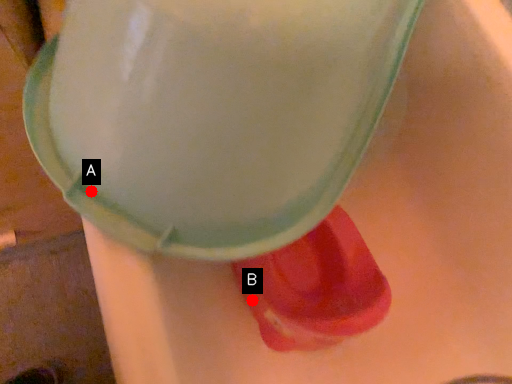
Question: Two points are circled on the image, labeled by A and B beside each circle. Which point is closer to the camera taking this photo?

Choices:
 (A) A is closer
 (B) B is closer

Answer: (A)